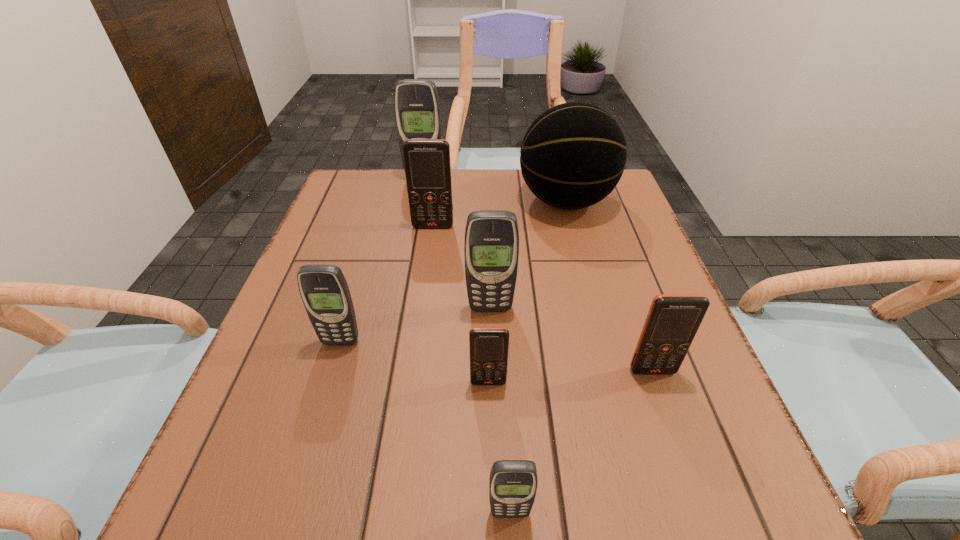
In order to click on the third nearest cellular telephone in this screenshot , I will do `click(673, 320)`.

This screenshot has height=540, width=960. I want to click on the smallest orange cellular telephone, so click(489, 346).

Where is `the sixth farthest cellular telephone`? The width and height of the screenshot is (960, 540). the sixth farthest cellular telephone is located at coordinates (489, 346).

Where is `the nearest cellular telephone`? This screenshot has height=540, width=960. the nearest cellular telephone is located at coordinates (513, 483).

This screenshot has height=540, width=960. I want to click on the smallest gray cellular telephone, so click(x=513, y=483).

You are a GUI agent. You are given a task and a screenshot of the screen. Output one action in this format:
    pyautogui.click(x=<x>, y=<y>)
    Task: Click on the free location located 0.240m on the screen of the farthest cellular telephone
    This screenshot has height=540, width=960.
    Given the screenshot: What is the action you would take?
    pyautogui.click(x=414, y=232)

Find the location of a particular element. The height and width of the screenshot is (540, 960). vacant region located 0.070m on the left of the basketball is located at coordinates (491, 201).

Locate an element on the screen. vacant space located 0.290m on the screen of the farthest orange cellular telephone is located at coordinates (420, 318).

This screenshot has width=960, height=540. Identify the location of vacant space situated 0.080m on the screen of the fifth nearest cellular telephone. (492, 345).

Locate an element on the screen. vacant space located 0.190m on the screen of the leftmost object is located at coordinates (310, 445).